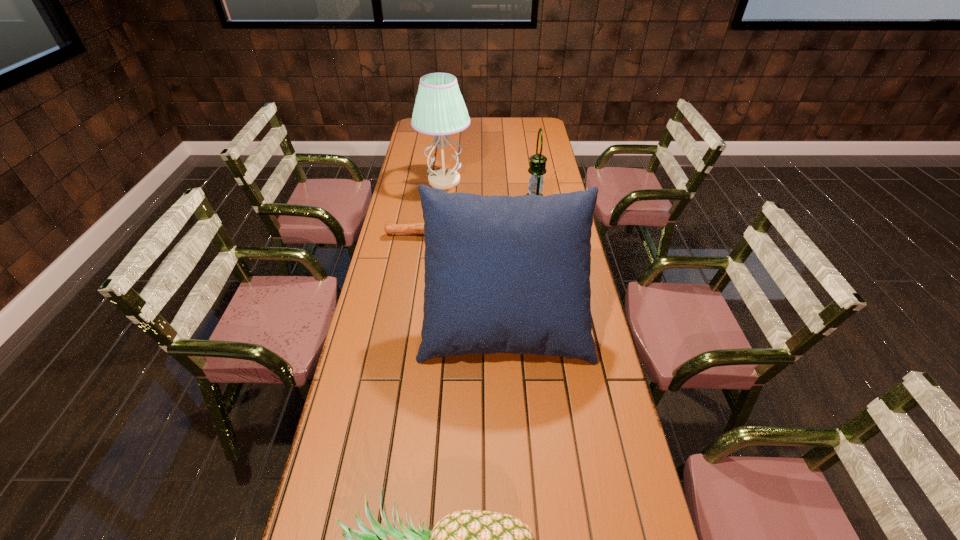
Locate an element on the screen. This screenshot has height=540, width=960. vacant space located 0.270m on the hammer head face of the shortest object is located at coordinates (532, 235).

Find the location of a particular element. lamp that is at the left edge is located at coordinates (439, 109).

This screenshot has width=960, height=540. In order to click on mallet that is at the left edge in this screenshot , I will do `click(417, 228)`.

The height and width of the screenshot is (540, 960). Identify the location of cushion that is positioned at the right edge. (503, 274).

The height and width of the screenshot is (540, 960). What are the coordinates of `lantern situated at the right edge` in the screenshot? It's located at (537, 169).

I want to click on free space at the far edge of the desktop, so click(x=474, y=121).

The width and height of the screenshot is (960, 540). What are the coordinates of `vacant area at the left edge of the desktop` in the screenshot? It's located at (403, 215).

I want to click on vacant space at the right edge of the desktop, so click(x=605, y=483).

The image size is (960, 540). Identify the location of free location at the far right corner. (536, 131).

Identify the location of vacant area between the lantern and the lamp. This screenshot has width=960, height=540. (490, 193).